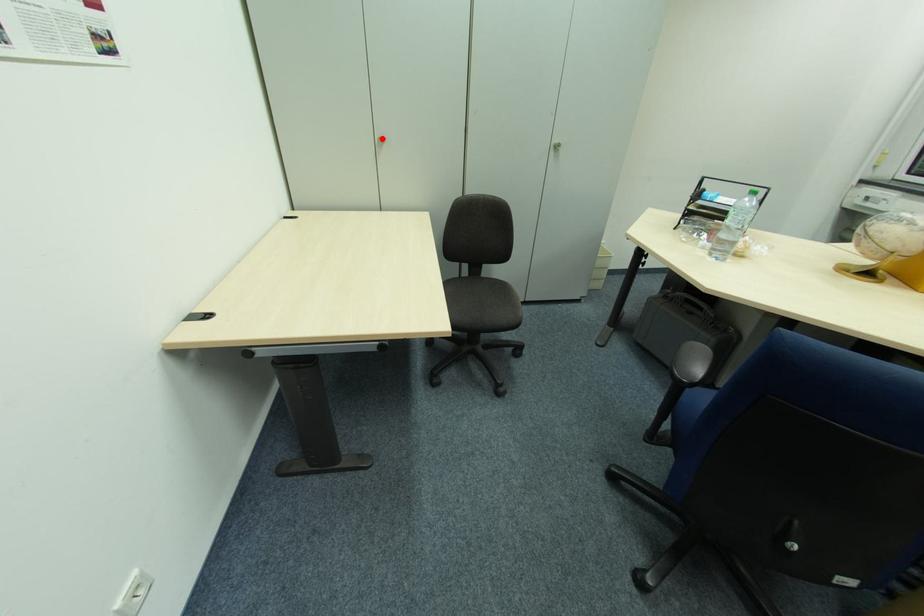
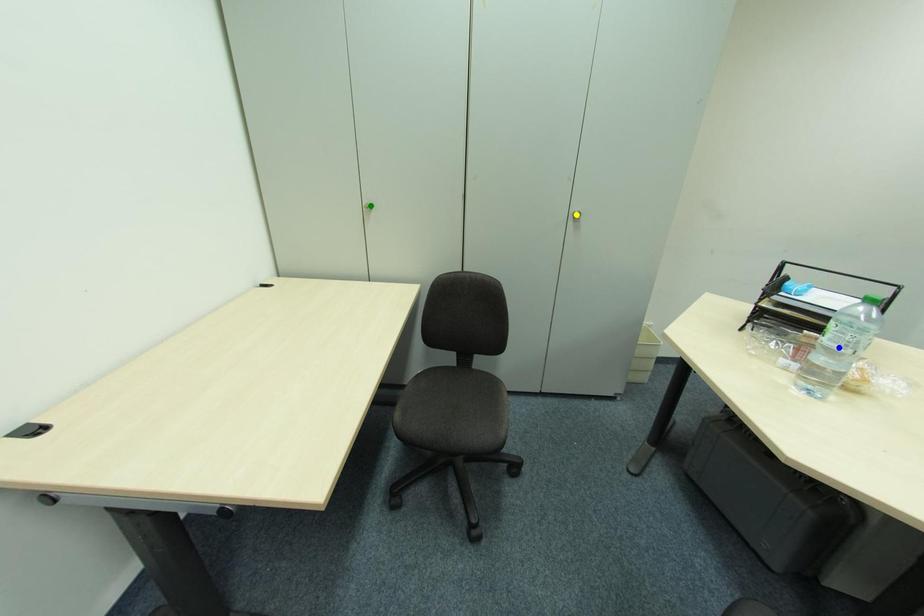
Question: I am providing you with two images of the same scene from different viewpoints. A red point is marked on the first image. You are given multiple points on the second image. Can you choose the point in image 2 that corresponds to the point in image 1?

Choices:
 (A) green point
 (B) yellow point
 (C) blue point

Answer: (A)